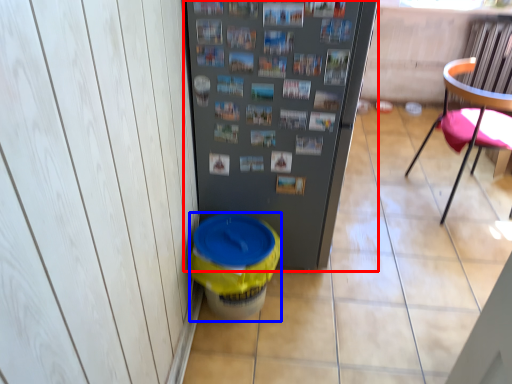
Question: Which of the following is the closest to the observer, refrigerator (highlighted by a red box) or potty (highlighted by a blue box)?

Choices:
 (A) refrigerator
 (B) potty

Answer: (A)